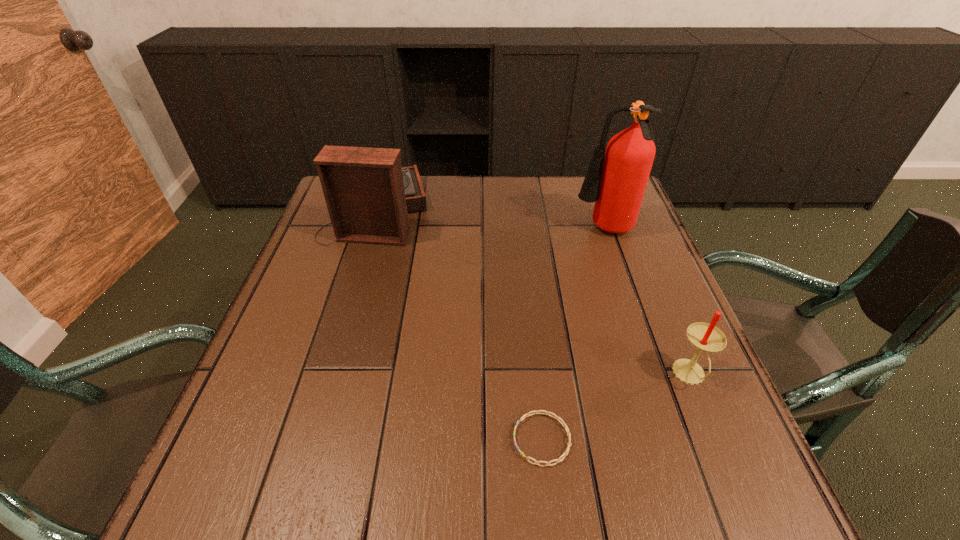
Image resolution: width=960 pixels, height=540 pixels. What are the coordinates of `fire extinguisher` in the screenshot? It's located at (616, 179).

You are a GUI agent. You are given a task and a screenshot of the screen. Output one action in this format:
    pyautogui.click(x=<x>, y=<y>)
    Task: Click on the third shortest object
    
    Given the screenshot: What is the action you would take?
    pyautogui.click(x=368, y=194)

This screenshot has height=540, width=960. In order to click on phonograph record in this screenshot , I will do `click(368, 194)`.

Where is `candle`? This screenshot has width=960, height=540. candle is located at coordinates (705, 337).

What are the coordinates of `the third tallest object` in the screenshot? It's located at (705, 337).

This screenshot has width=960, height=540. I want to click on bracelet, so click(x=524, y=416).

The height and width of the screenshot is (540, 960). Identify the location of the shortest object. (524, 416).

At what (x,y) coordinates should I click in order to perform the action: click on free space located at the nozzle of the tallest object. Please return your answer as a coordinate pair (x, y). The width and height of the screenshot is (960, 540). Looking at the image, I should click on (466, 231).

I want to click on vacant space situated at the nozzle of the tallest object, so click(x=480, y=231).

Identify the location of free space located at the nozzle of the tallest object. The height and width of the screenshot is (540, 960). (502, 231).